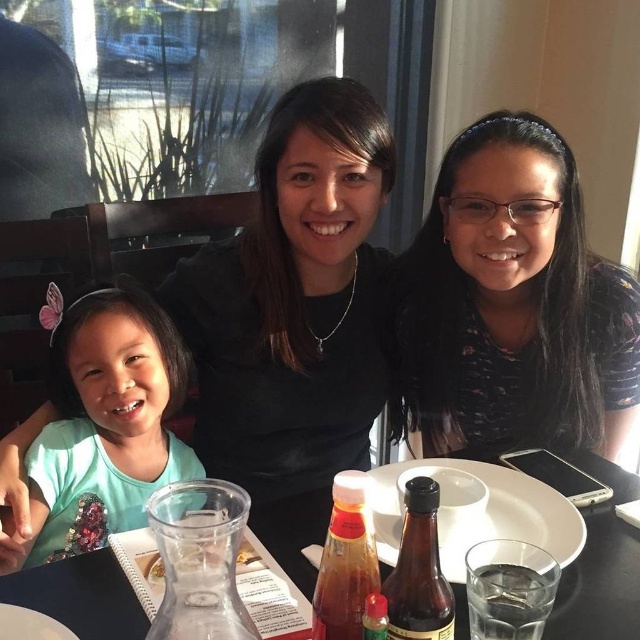
Which of these two, black matte shirt at upper center or green matte shirt at left, stands taller?

Standing taller between the two is black matte shirt at upper center.

Is black matte shirt at upper center smaller than green matte shirt at left?

No.

This screenshot has width=640, height=640. In order to click on black matte shirt at upper center in this screenshot , I will do `click(513, 304)`.

Can you confirm if black matte shirt at center is positioned to the right of green matte shirt at left?

Correct, you'll find black matte shirt at center to the right of green matte shirt at left.

Which of these two, black matte shirt at center or green matte shirt at left, stands taller?

With more height is black matte shirt at center.

Image resolution: width=640 pixels, height=640 pixels. I want to click on black matte shirt at center, so click(x=294, y=316).

Between black matte shirt at center and black matte shirt at upper center, which one appears on the left side from the viewer's perspective?

Positioned to the left is black matte shirt at center.

Can you confirm if black matte shirt at center is wider than black matte shirt at upper center?

Yes, black matte shirt at center is wider than black matte shirt at upper center.

Is point (273, 472) positioned after point (536, 376)?

Yes, point (273, 472) is farther from viewer.

Where is `black matte shirt at center`? This screenshot has width=640, height=640. black matte shirt at center is located at coordinates (294, 316).